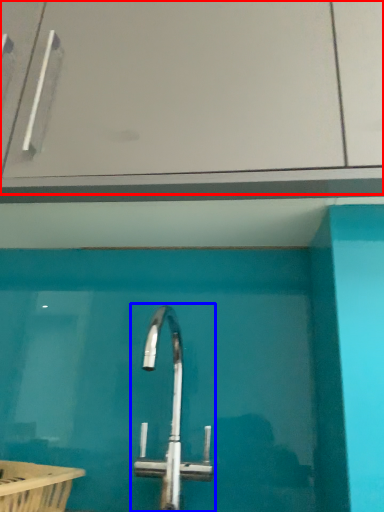
Question: Which object is further to the camera taking this photo, glass door (highlighted by a red box) or tap (highlighted by a blue box)?

Choices:
 (A) glass door
 (B) tap

Answer: (A)